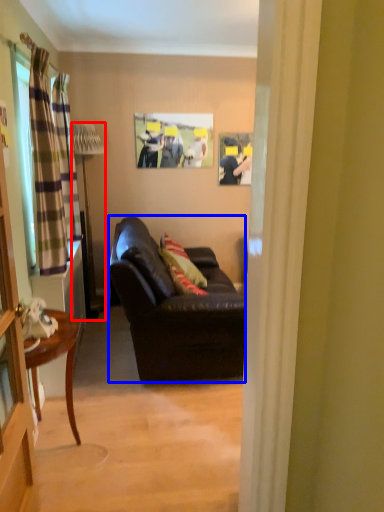
Question: Which of the following is the farthest to the observer, lamp (highlighted by a red box) or studio couch (highlighted by a blue box)?

Choices:
 (A) lamp
 (B) studio couch

Answer: (A)